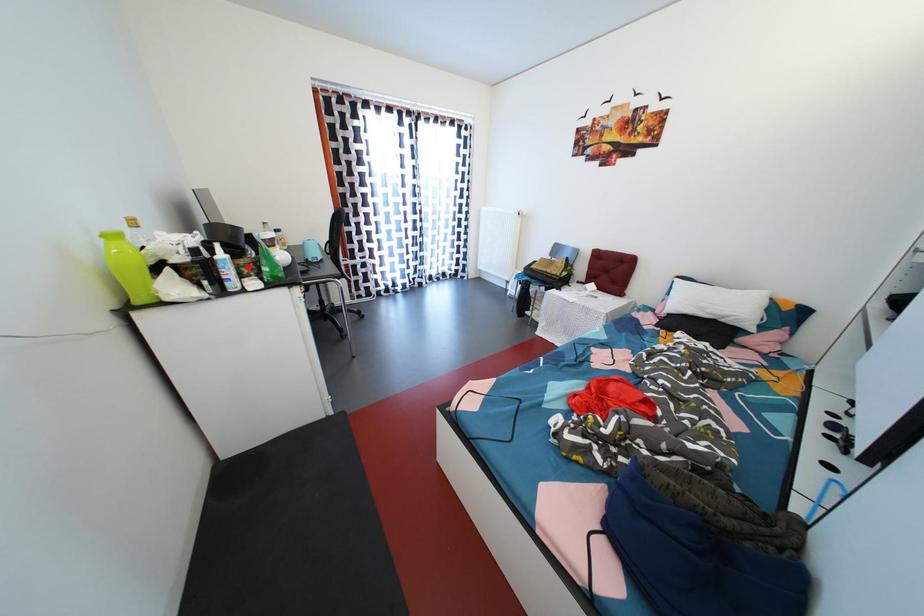
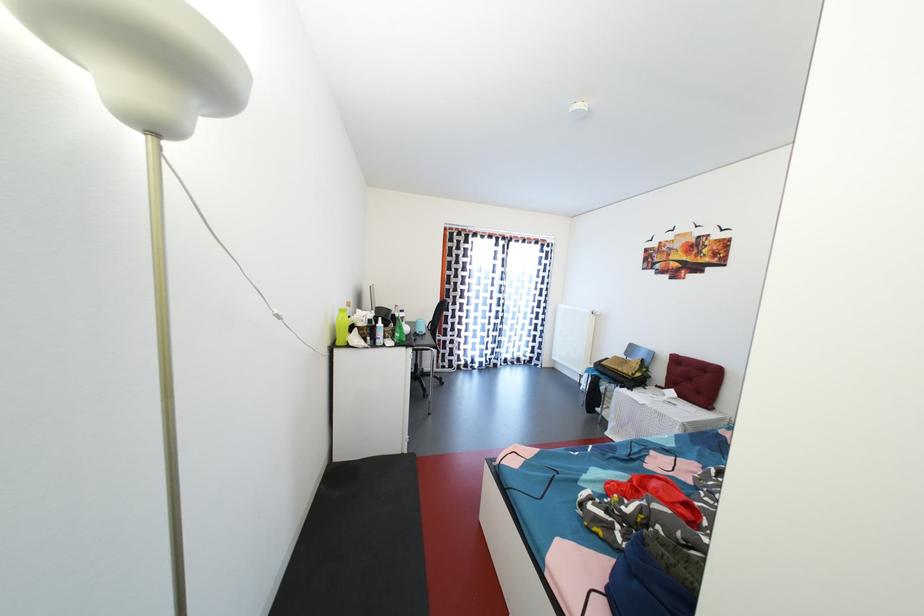
Where in the second image is the point corresponding to the highlighted location from the first image?

(394, 334)